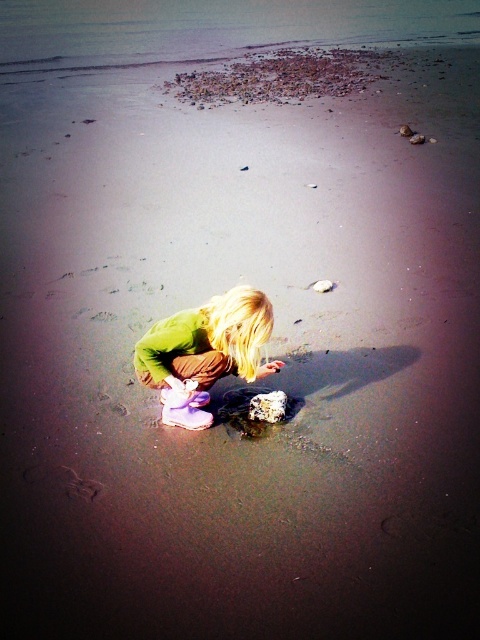
Is green fabric shirt at center positioned at the back of smooth gray rock at lower center?

No, green fabric shirt at center is in front of smooth gray rock at lower center.

Consider the image. Is green fabric shirt at center above smooth gray rock at lower center?

Indeed, green fabric shirt at center is positioned over smooth gray rock at lower center.

Who is more forward, (142,364) or (261,420)?

Point (142,364)

Find the location of `green fabric shirt at center`. green fabric shirt at center is located at coordinates (204, 353).